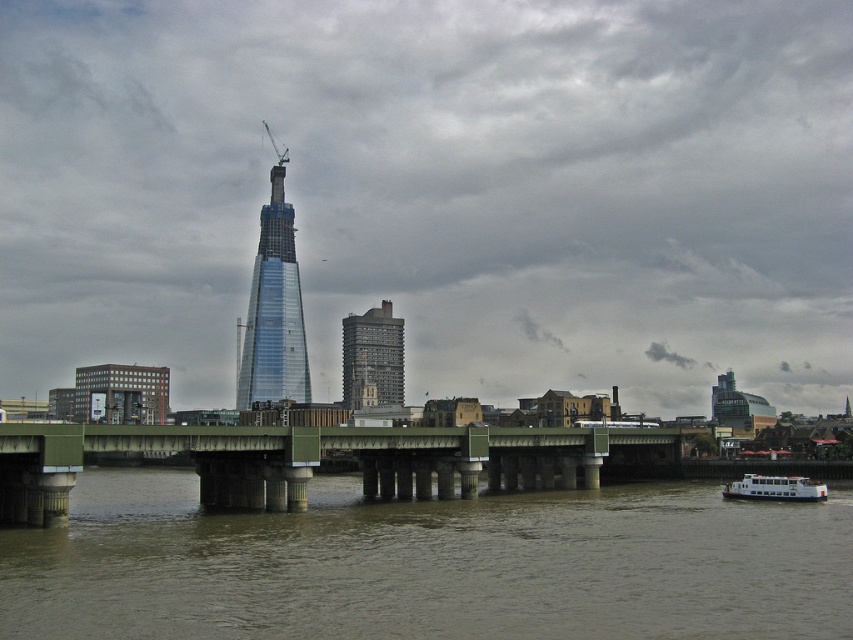
You are a city planner analyzing the image. You need to determine which area occupies more space in the foreground between the brown muddy water at lower center and the green concrete bridge at center. Which one is larger?

The brown muddy water at lower center is bigger than the green concrete bridge at center, so the brown muddy water at lower center occupies more space in the foreground.

You are a city planner reviewing the construction plans. The transparent glass tower at center and the white matte boat at lower right are both part of the proposed design. Based on their widths, which one would require more space for construction or placement?

The transparent glass tower at center requires more space because its width surpasses that of the white matte boat at lower right.